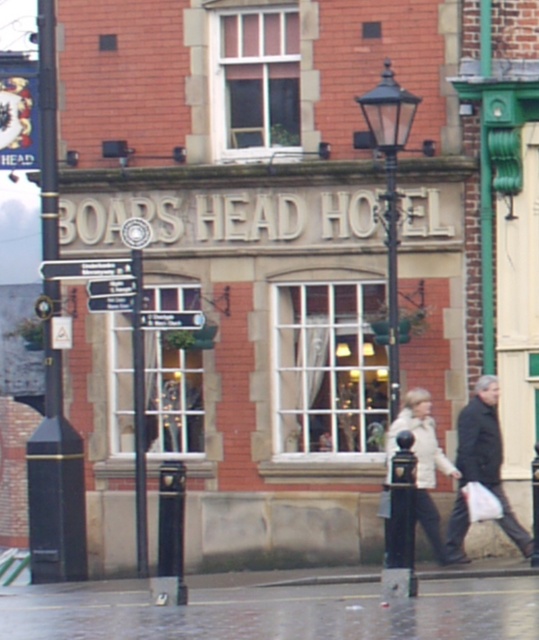
Between point (252, 595) and point (58, 529), which one is positioned behind?

Point (58, 529)

Can you confirm if concrete pavement at lower center is bigger than black metal pole at left?

Yes.

Does point (370, 602) come in front of point (47, 456)?

Yes, it is.

I want to click on concrete pavement at lower center, so click(x=285, y=605).

Does black metal pole at left appear on the left side of dark gray jacket at lower right?

Correct, you'll find black metal pole at left to the left of dark gray jacket at lower right.

Locate an element on the screen. black metal pole at left is located at coordinates (54, 474).

Between point (59, 564) and point (468, 445), which one is positioned in front?

Point (468, 445)

What are the coordinates of `black metal pole at left` in the screenshot? It's located at (54, 474).

What do you see at coordinates (285, 605) in the screenshot? I see `concrete pavement at lower center` at bounding box center [285, 605].

Who is positioned more to the right, concrete pavement at lower center or white matte jacket at center?

white matte jacket at center is more to the right.

Between point (103, 624) and point (416, 433), which one is positioned behind?

Point (416, 433)

The image size is (539, 640). In order to click on concrete pavement at lower center in this screenshot , I will do `click(285, 605)`.